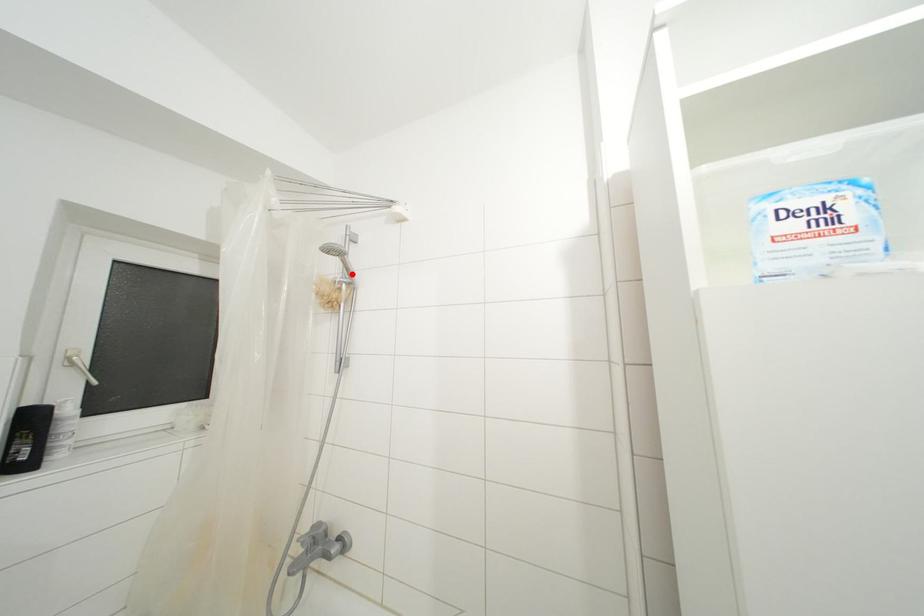
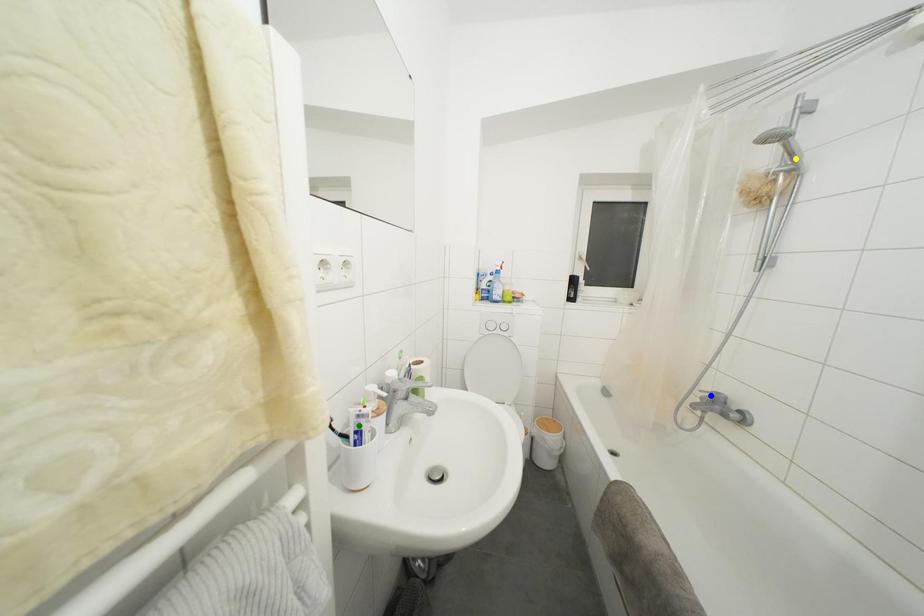
Question: I am providing you with two images of the same scene from different viewpoints. A red point is marked on the first image. You are given multiple points on the second image. In image 2, which mark is for the same physical point as the one in image 1?

Choices:
 (A) green point
 (B) yellow point
 (C) blue point

Answer: (B)